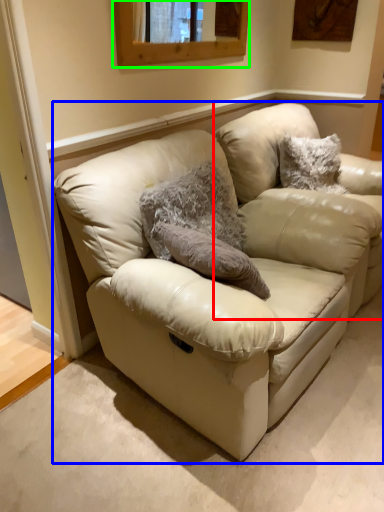
Question: Which object is positioned closest to swivel chair (highlighted by a red box)? Select from studio couch (highlighted by a blue box) and window (highlighted by a green box).

Choices:
 (A) studio couch
 (B) window

Answer: (B)